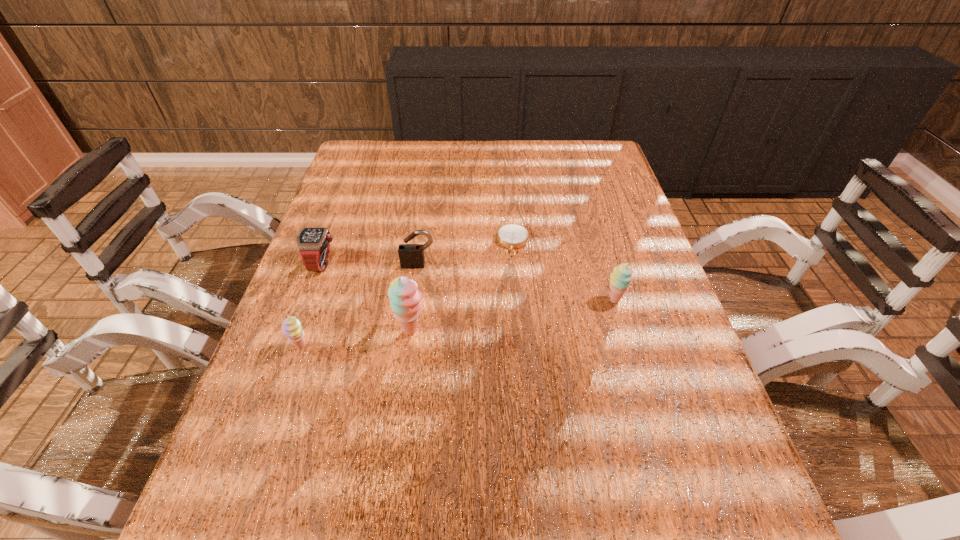
What are the coordinates of `the shortest sherbert` in the screenshot? It's located at (291, 327).

The height and width of the screenshot is (540, 960). I want to click on the tallest sherbert, so click(405, 299).

At what (x,y) coordinates should I click in order to perform the action: click on the second sherbert from left to right. Please return your answer as a coordinate pair (x, y). Looking at the image, I should click on (405, 299).

Where is `the second shortest sherbert`? This screenshot has height=540, width=960. the second shortest sherbert is located at coordinates (620, 279).

Identify the location of the farthest sherbert. (620, 279).

Find the location of a particular element. This screenshot has height=540, width=960. watch is located at coordinates point(313,244).

You are a GUI agent. You are given a task and a screenshot of the screen. Output one action in this format:
    pyautogui.click(x=<x>, y=<y>)
    Task: Click on the padlock
    This screenshot has width=960, height=540.
    Given the screenshot: What is the action you would take?
    pyautogui.click(x=409, y=254)

The image size is (960, 540). I want to click on the fifth object from left to right, so click(x=512, y=236).

Locate an element on the screen. Image resolution: width=960 pixels, height=540 pixels. the shortest object is located at coordinates (512, 236).

At what (x,y) coordinates should I click in order to perform the action: click on free space located 0.060m on the back of the leftmost sherbert. Please return your answer as a coordinate pair (x, y). Looking at the image, I should click on (310, 318).